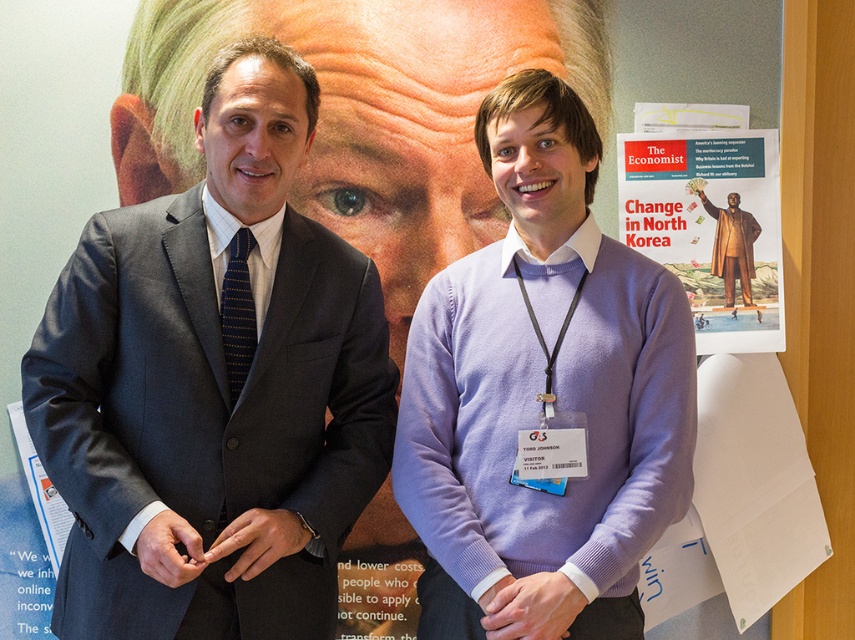
Does blue striped tie at left have a larger size compared to gold metallic statue at center?

Incorrect, blue striped tie at left is not larger than gold metallic statue at center.

Describe the element at coordinates (237, 312) in the screenshot. I see `blue striped tie at left` at that location.

Locate an element on the screen. The height and width of the screenshot is (640, 855). blue striped tie at left is located at coordinates (237, 312).

From the picture: Is matte paper poster at upper right wider than gold metallic statue at center?

Yes, matte paper poster at upper right is wider than gold metallic statue at center.

Does point (776, 195) come in front of point (738, 269)?

Yes, it is in front of point (738, 269).

In order to click on matte paper poster at upper right in this screenshot , I will do `click(711, 227)`.

Based on the photo, is matte black suit at left wider than gold metallic statue at center?

Correct, the width of matte black suit at left exceeds that of gold metallic statue at center.

I want to click on matte black suit at left, so click(x=364, y=113).